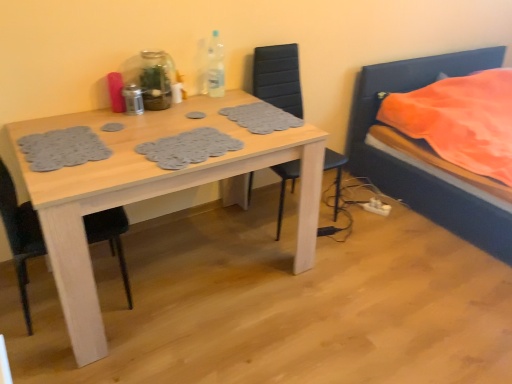
The height and width of the screenshot is (384, 512). Find the location of `free region on the left part of white plastic power plugs and sockets at lower right`. free region on the left part of white plastic power plugs and sockets at lower right is located at coordinates (356, 211).